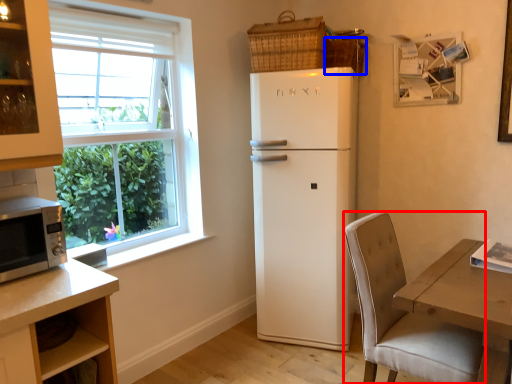
Question: Which of the following is the closest to the observer, chair (highlighted by a red box) or basket (highlighted by a blue box)?

Choices:
 (A) chair
 (B) basket

Answer: (A)